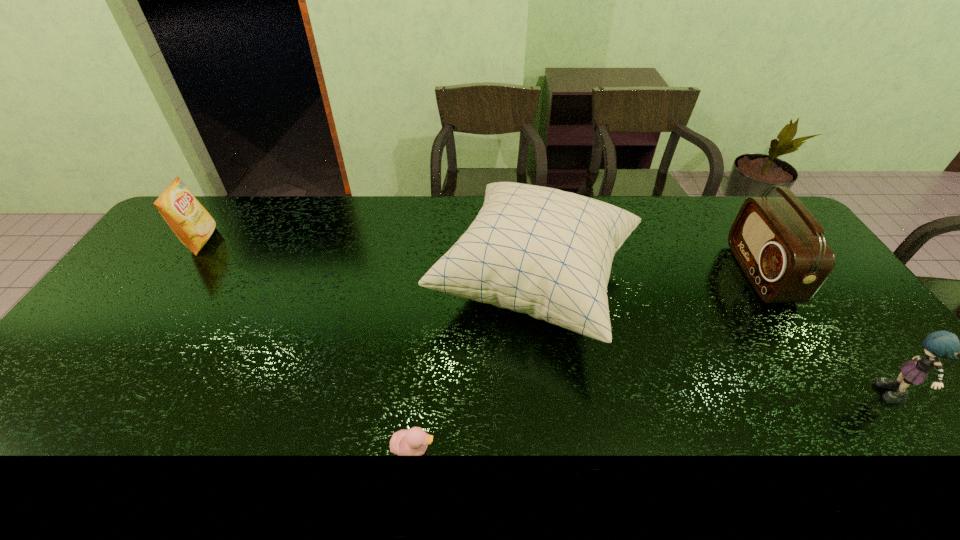
Identify the location of cushion. The image size is (960, 540). (545, 252).

Locate an element on the screen. radio receiver is located at coordinates (780, 246).

Where is `the rightmost object`? the rightmost object is located at coordinates point(941,344).

Locate an element on the screen. Image resolution: width=960 pixels, height=540 pixels. the fourth farthest object is located at coordinates (941, 344).

Identify the location of crisp (potato chip). (193, 225).

This screenshot has width=960, height=540. What are the coordinates of `the shortest object` in the screenshot? It's located at (406, 442).

In order to click on duckling in this screenshot , I will do `click(406, 442)`.

The height and width of the screenshot is (540, 960). In order to click on free space located on the left of the cushion in this screenshot , I will do `click(381, 285)`.

You are a GUI agent. You are given a task and a screenshot of the screen. Output one action in this format:
    pyautogui.click(x=<x>, y=<y>)
    Task: Click on the free spot located on the front panel of the radio receiver
    
    Given the screenshot: What is the action you would take?
    pyautogui.click(x=665, y=273)

Image resolution: width=960 pixels, height=540 pixels. Identify the location of vacant area situated on the front panel of the radio receiver. (684, 273).